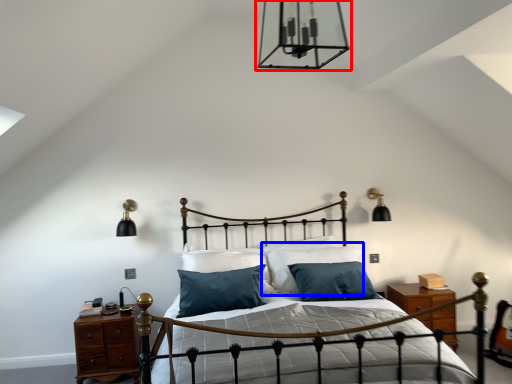
Question: Which object appears closest to the camera in this image, light fixture (highlighted by a red box) or pillow (highlighted by a blue box)?

Choices:
 (A) light fixture
 (B) pillow

Answer: (A)